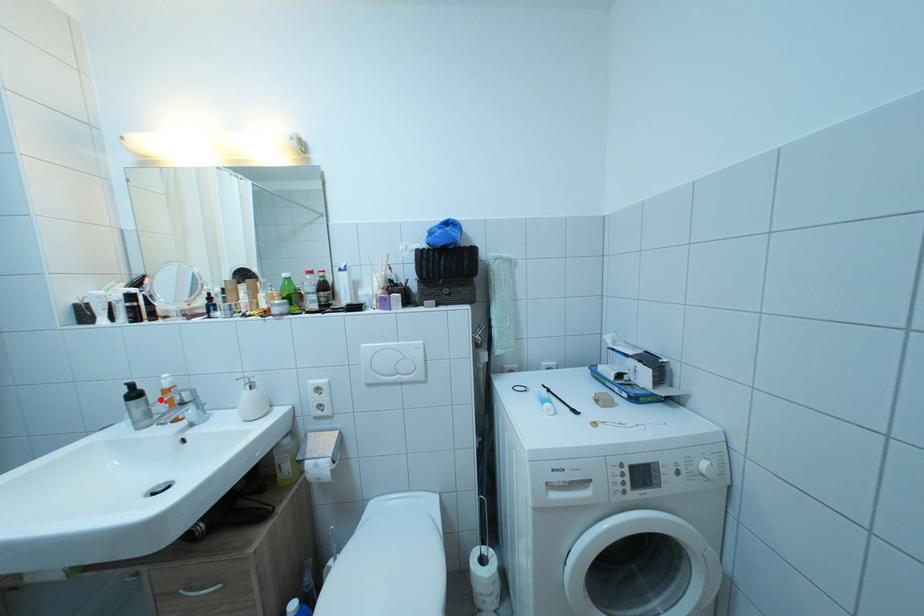
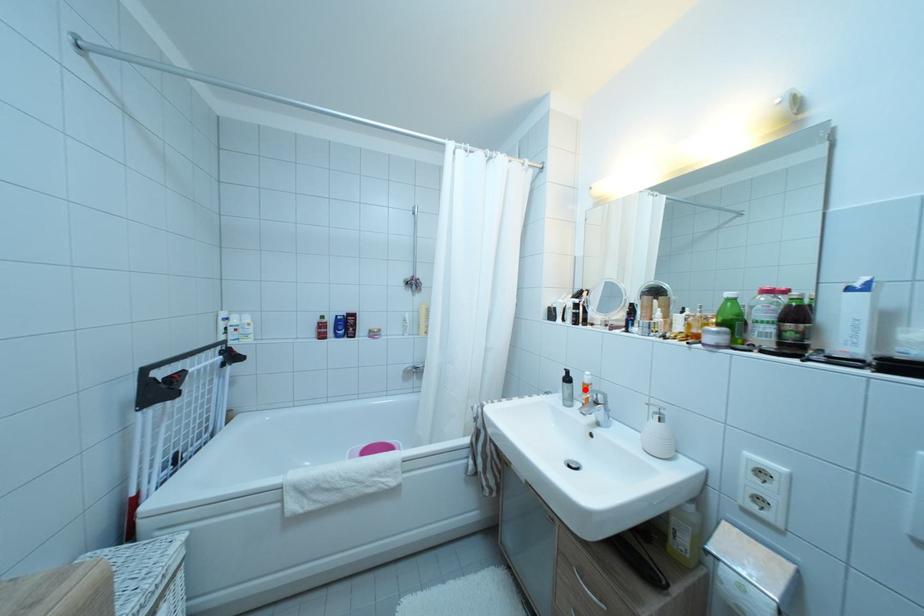
I am providing you with two images of the same scene from different viewpoints. A red point is marked on the first image and another point is marked on the second image. Is the marked point in image1 the same physical position as the marked point in image2?

Yes